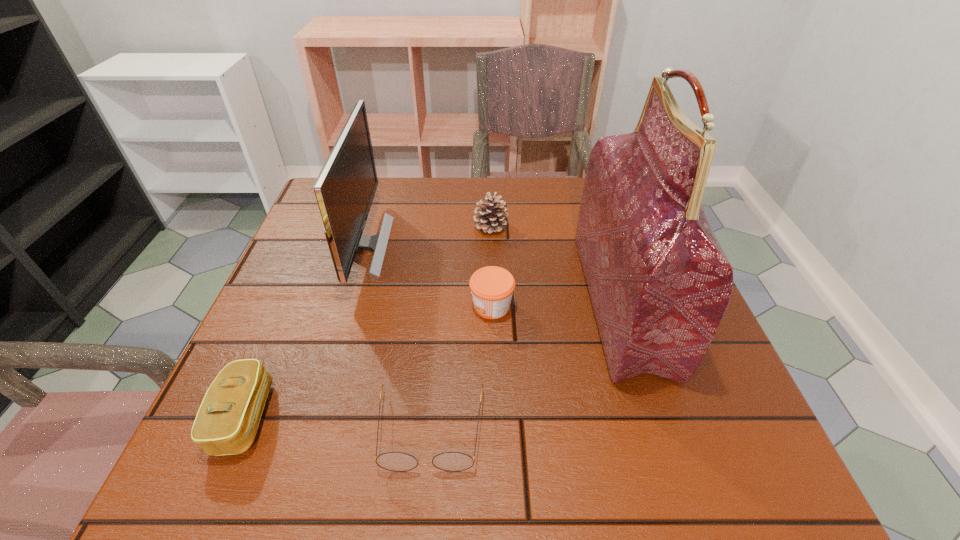
At what (x,y) coordinates should I click in order to perform the action: click on spectacles that is at the near edge. Please return your answer as a coordinate pair (x, y). Looking at the image, I should click on (393, 461).

Find the location of a particular element. monitor that is at the left edge is located at coordinates (345, 188).

Find the location of a particular element. This screenshot has height=540, width=960. clutch bag positioned at the left edge is located at coordinates (228, 418).

The image size is (960, 540). What are the coordinates of `object that is at the right edge` in the screenshot? It's located at (659, 281).

You are a GUI agent. You are given a task and a screenshot of the screen. Output one action in this format:
    pyautogui.click(x=<x>, y=<y>)
    Task: Click on the object that is at the far left corner
    
    Given the screenshot: What is the action you would take?
    pyautogui.click(x=345, y=188)

You are a GUI agent. You are given a task and a screenshot of the screen. Output one action in this format:
    pyautogui.click(x=<x>, y=<y>)
    Task: Click on the object that is at the near left corner
    
    Given the screenshot: What is the action you would take?
    pyautogui.click(x=228, y=418)

You are a GUI agent. You are given a task and a screenshot of the screen. Output one action in this format:
    pyautogui.click(x=<x>, y=<y>)
    Task: Click on the vacant area at the far edge of the desktop
    The height and width of the screenshot is (540, 960).
    Given the screenshot: What is the action you would take?
    pyautogui.click(x=460, y=204)

In the image, there is a desktop. Where is `vacant area at the near edge`? The image size is (960, 540). vacant area at the near edge is located at coordinates (427, 475).

Find the location of `free spot at the left edge of the desktop`. free spot at the left edge of the desktop is located at coordinates (325, 252).

The image size is (960, 540). Identify the location of vacant space at the right edge. (716, 352).